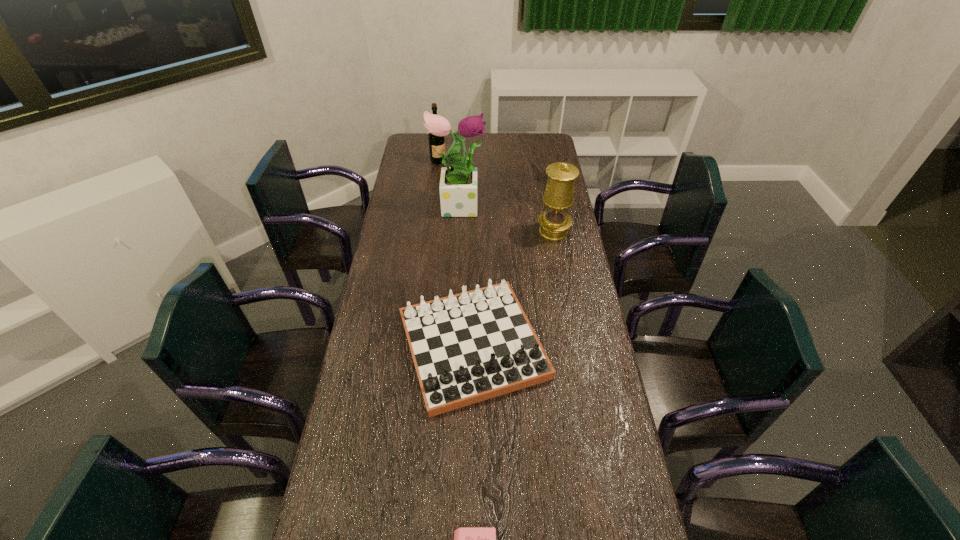
Find the location of `gameboard at the left edge`. gameboard at the left edge is located at coordinates (469, 347).

This screenshot has width=960, height=540. Identify the location of object that is at the right edge. (554, 222).

Find the location of a particular element. This screenshot has height=540, width=960. vacant space at the left edge of the desktop is located at coordinates (350, 482).

At what (x,y) coordinates should I click in order to perform the action: click on vacant space at the right edge of the desktop. Please return your answer as a coordinate pair (x, y). This screenshot has width=960, height=540. Looking at the image, I should click on (593, 457).

In the image, there is a desktop. Identify the location of free space at the far right corner. pyautogui.click(x=536, y=146).

Image resolution: width=960 pixels, height=540 pixels. Identify the location of free space between the fourth tallest object and the liquor. (456, 253).

Locate an element on the screen. free space between the tallest object and the oil lamp is located at coordinates (506, 218).

Where is `vacant region between the gameboard and the liquor`? The height and width of the screenshot is (540, 960). vacant region between the gameboard and the liquor is located at coordinates (456, 253).

Image resolution: width=960 pixels, height=540 pixels. I want to click on the fifth closest object to the shortest object, so click(437, 142).

Image resolution: width=960 pixels, height=540 pixels. I want to click on the fourth closest object to the flower arrangement, so 466,539.